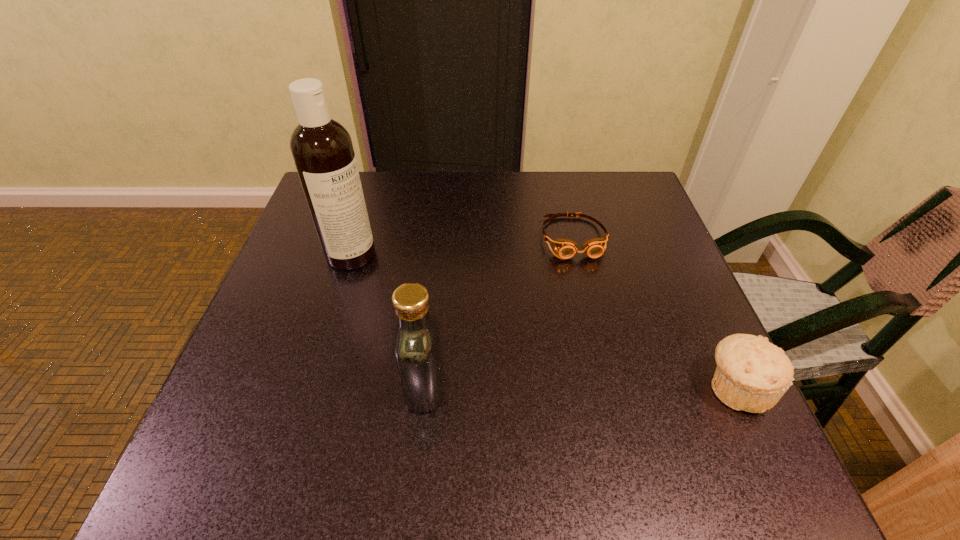
Find the location of `free spot on the desktop that is between the vodka and the third tallest object and is positioned on the label side of the tallest object`. free spot on the desktop that is between the vodka and the third tallest object and is positioned on the label side of the tallest object is located at coordinates (600, 387).

Where is `free space on the desktop that is between the second tallest object and the rightmost object and is positioned with the lenses facing forward on the third object from left to right`? The width and height of the screenshot is (960, 540). free space on the desktop that is between the second tallest object and the rightmost object and is positioned with the lenses facing forward on the third object from left to right is located at coordinates (616, 387).